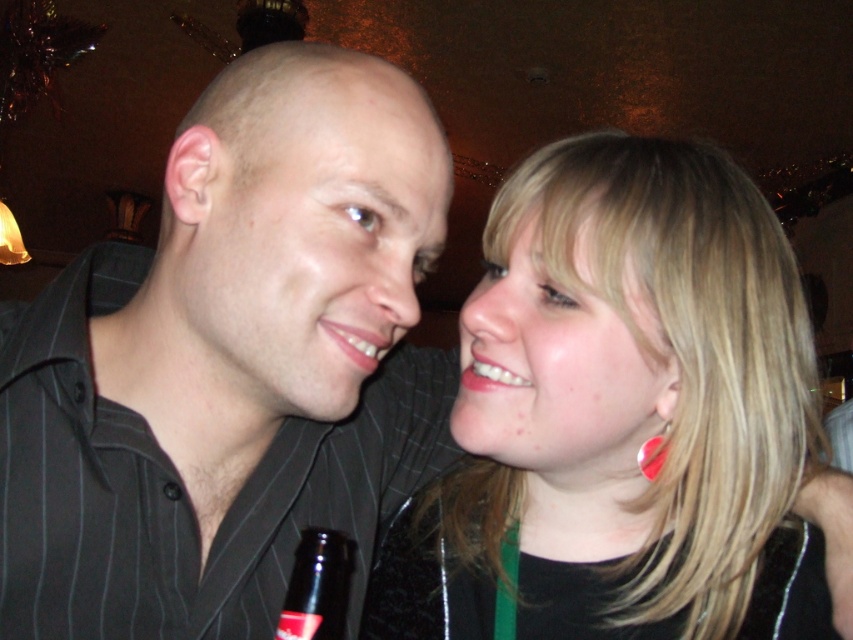
From the picture: You are a bartender who needs to place a new drink order. The black glass bottle at lower center and the matte pink lipstick at lower right are on the counter. If the minimum distance required between items for proper storage is 6 inches, can you place another item between them?

The black glass bottle at lower center is only 5.43 inches from the matte pink lipstick at lower right, which is less than the required 6 inches. Therefore, you cannot place another item between them without violating the storage distance requirement.

You are a photographer adjusting your camera to focus on the blonde hair at center and the matte pink lipstick at center. Which object should you focus on first to ensure it appears sharp in the photo?

The blonde hair at center is further to the viewer than the matte pink lipstick at center, so you should focus on the blonde hair at center first to ensure it appears sharp.

You are a photographer setting up for a portrait shoot and need to place a matte pink lipstick at center in the scene. According to the image, where should you position it?

The matte pink lipstick at center should be positioned at the coordinates point (x=358, y=342).